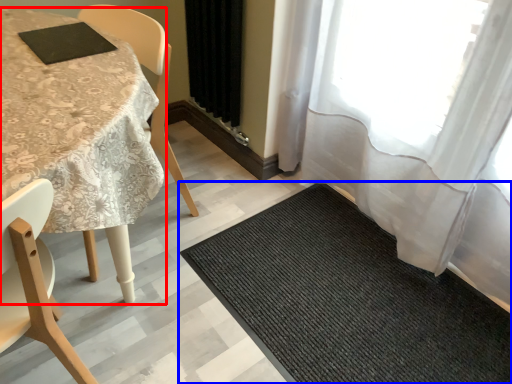
Question: Which of the following is the closest to the observer, table (highlighted by a red box) or mat (highlighted by a blue box)?

Choices:
 (A) table
 (B) mat

Answer: (A)